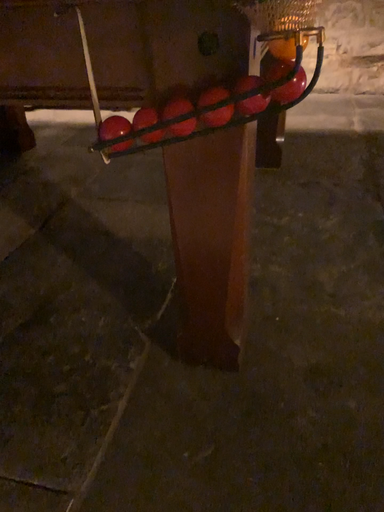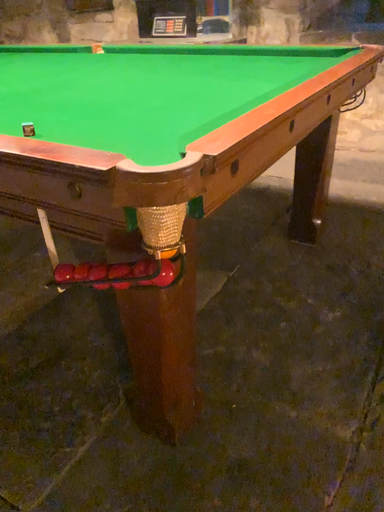
Question: How did the camera likely rotate when shooting the video?

Choices:
 (A) rotated left
 (B) rotated right

Answer: (A)